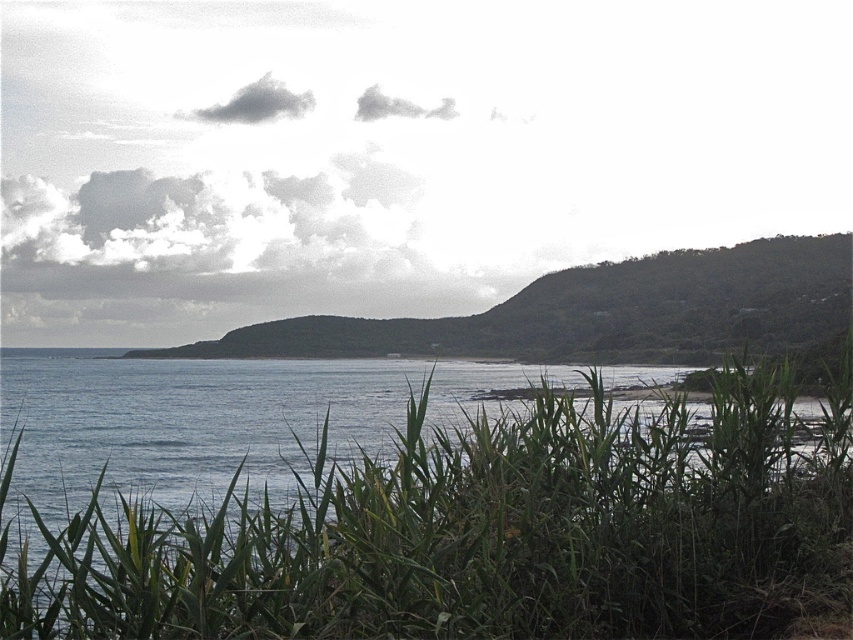
Question: Which object appears closest to the camera in this image?

Choices:
 (A) green textured hill at center
 (B) green leafy grass at lower center

Answer: (B)

Question: Is green leafy grass at lower center to the right of green textured hill at center from the viewer's perspective?

Choices:
 (A) no
 (B) yes

Answer: (A)

Question: Is green leafy grass at lower center in front of green textured hill at center?

Choices:
 (A) yes
 (B) no

Answer: (A)

Question: Is green leafy grass at lower center to the left of green textured hill at center from the viewer's perspective?

Choices:
 (A) no
 (B) yes

Answer: (B)